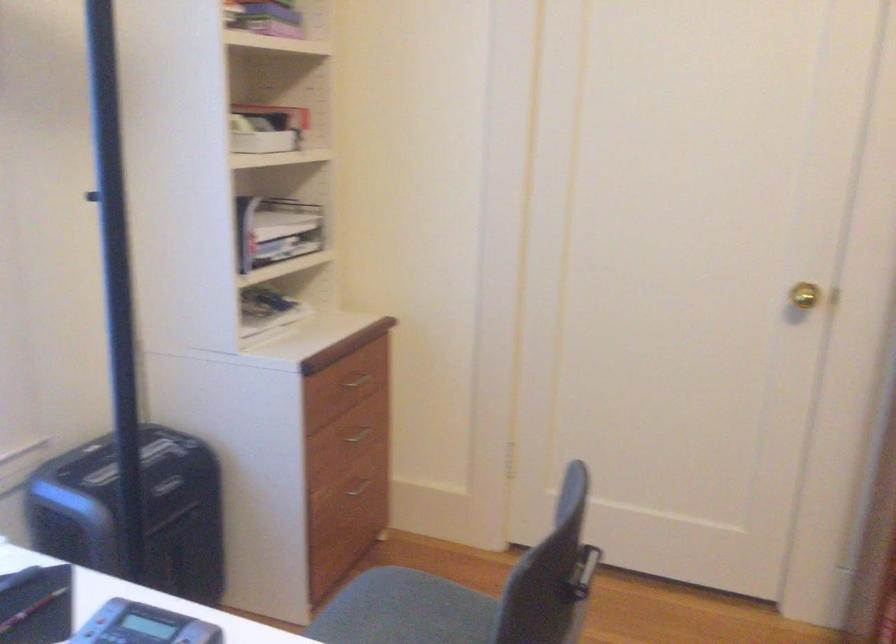
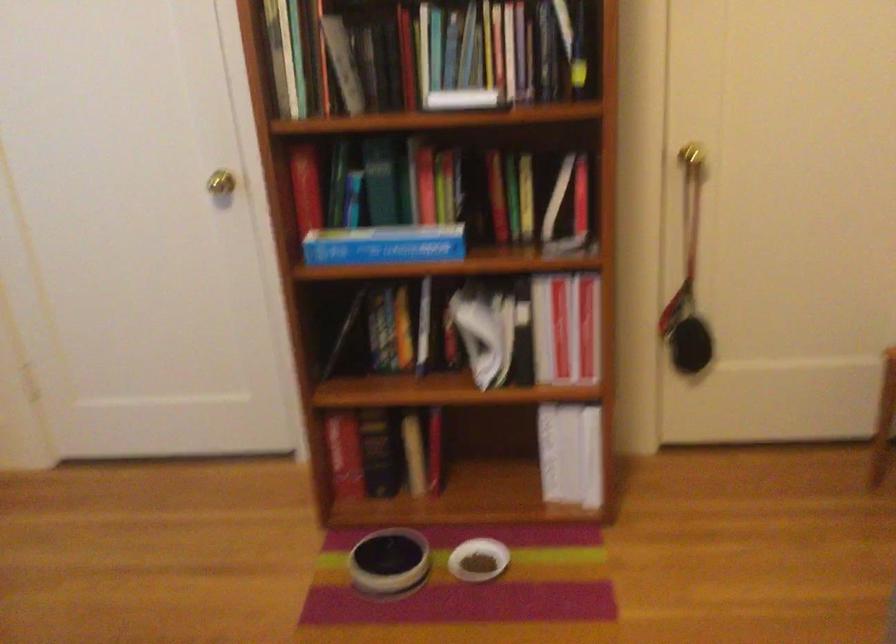
Question: The camera is either moving clockwise (left) or counter-clockwise (right) around the object. The first image is from the beginning of the video and the second image is from the end. Is the camera moving left or right when shooting the video?

Choices:
 (A) Left
 (B) Right

Answer: (A)